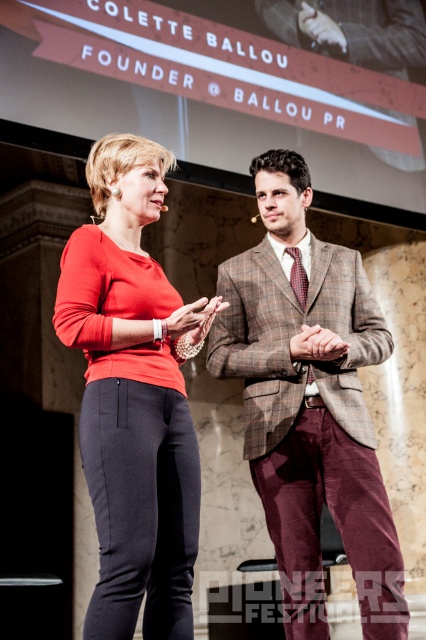
Question: Is plaid wool suit at center wider than matte red blouse at center?

Choices:
 (A) no
 (B) yes

Answer: (B)

Question: Which of the following is the closest to the observer?

Choices:
 (A) (389, 582)
 (B) (132, 156)

Answer: (B)

Question: Which point is closer to the camera taking this photo?

Choices:
 (A) (308, 572)
 (B) (132, 422)

Answer: (B)

Question: Does plaid wool suit at center appear on the left side of matte red blouse at center?

Choices:
 (A) yes
 (B) no

Answer: (B)

Question: Can you confirm if plaid wool suit at center is bigger than matte red blouse at center?

Choices:
 (A) no
 (B) yes

Answer: (A)